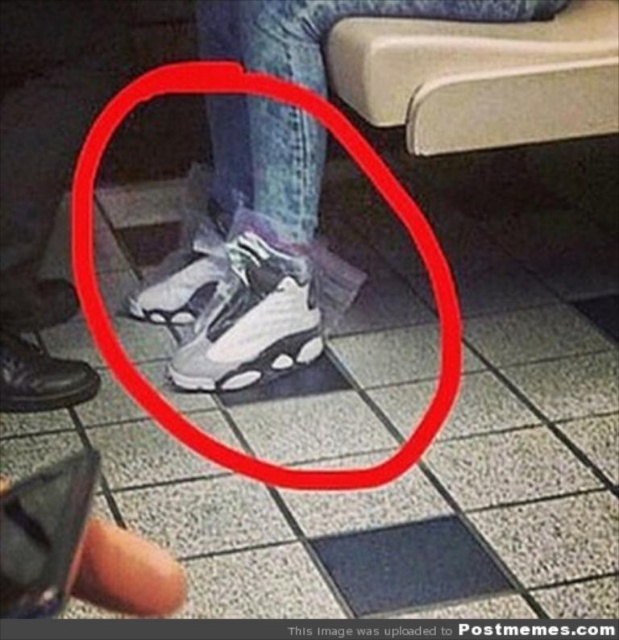
You are a passenger sitting in the train and you see two sneakers at center. Which one is closer to you, the white leather sneaker at center or the matte white sneaker at center?

The white leather sneaker at center is closer to you because the matte white sneaker at center is behind it.

You are a passenger on a train and notice two pairs of shoes near your seat. One is labeled as the white matte sneakers at center and the other as the white matte sneaker at center. Which pair has a greater width?

The white matte sneakers at center has a greater width than the white matte sneaker at center.